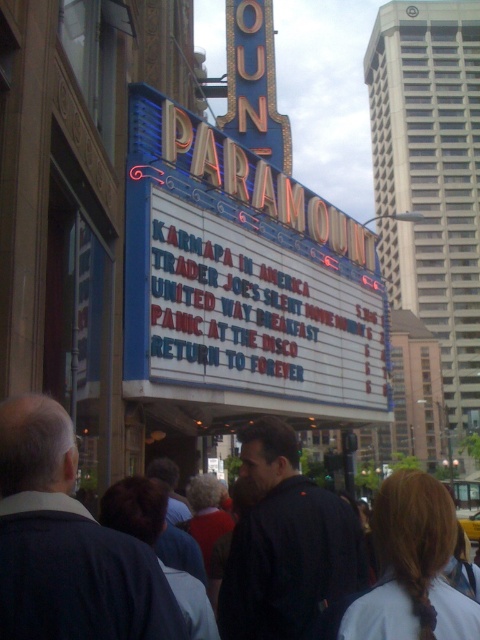
You are a photographer standing at the Paramount Theatre and want to take a picture of the dark blue clothing at center and the yellow rubber taxi at center. Which object should you focus on first if you want to capture both in a single frame without moving the camera?

The dark blue clothing at center is shorter than the yellow rubber taxi at center, so you should focus on the yellow rubber taxi at center first to ensure both are in focus.